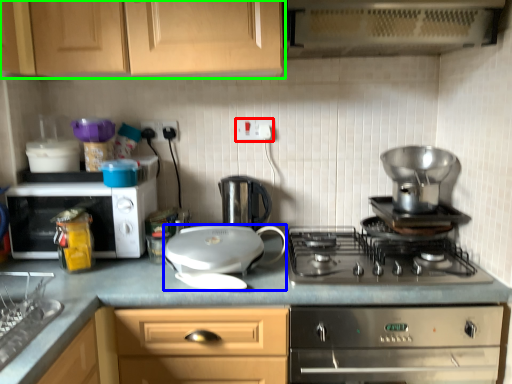
Question: Estimate the real-world distances between objects in this image. Which object is farther from electric outlet (highlighted by a red box), kitchen appliance (highlighted by a blue box) or cabinetry (highlighted by a green box)?

Choices:
 (A) kitchen appliance
 (B) cabinetry

Answer: (A)